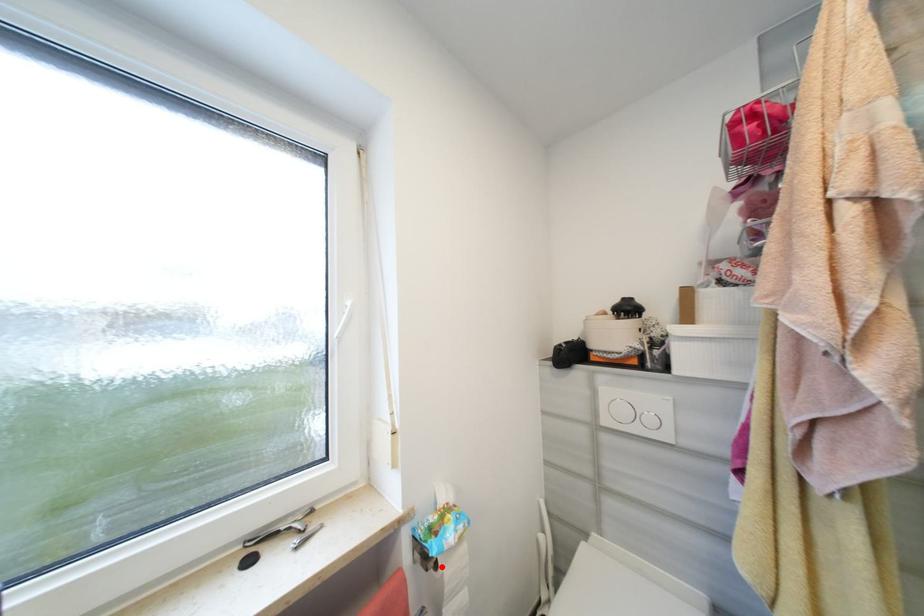
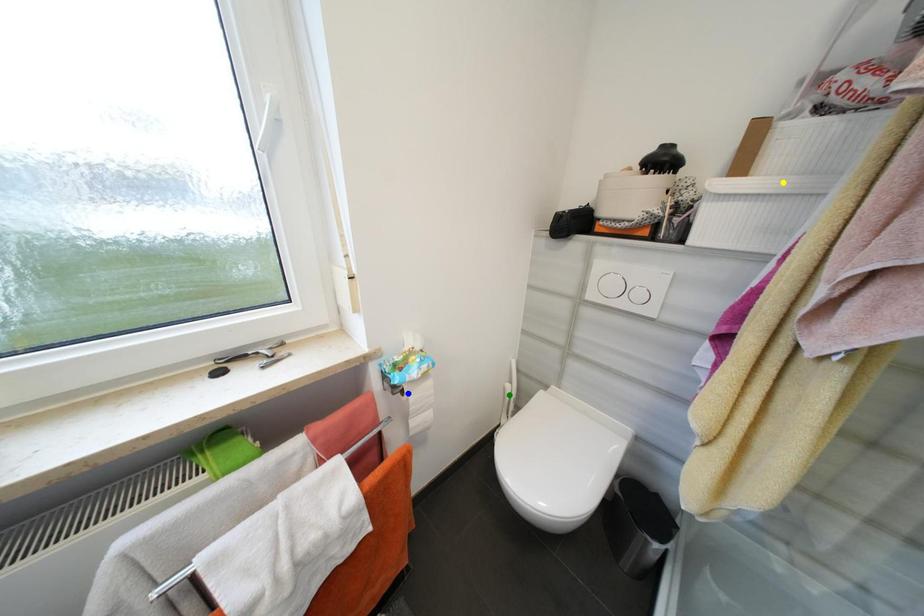
Question: I am providing you with two images of the same scene from different viewpoints. A red point is marked on the first image. You are given multiple points on the second image. Which point in image 2 is actually the same real-world point as the red point in image 1?

Choices:
 (A) blue point
 (B) yellow point
 (C) green point

Answer: (A)